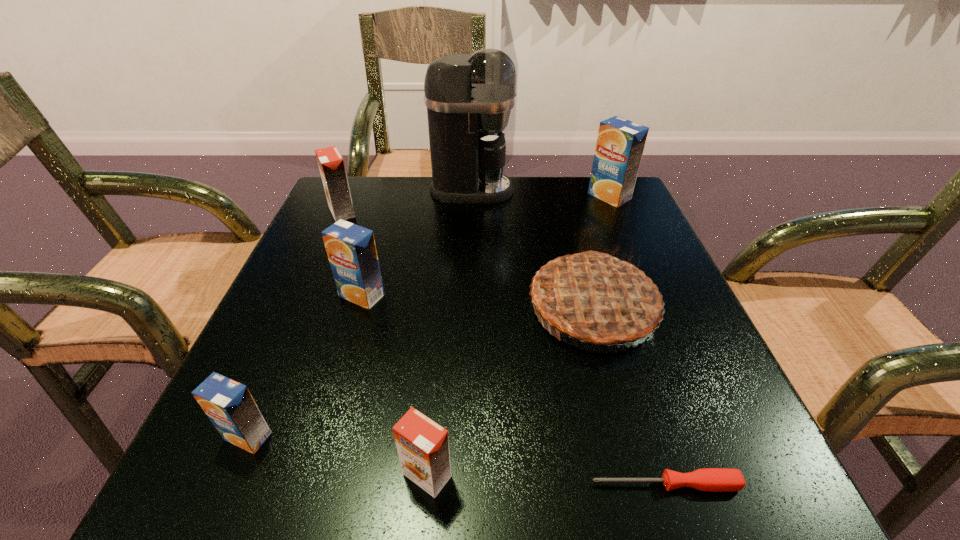
The height and width of the screenshot is (540, 960). I want to click on coffee maker, so click(463, 93).

You are a GUI agent. You are given a task and a screenshot of the screen. Output one action in this format:
    pyautogui.click(x=<x>, y=<y>)
    Task: Click on the rightmost orange juice
    The image size is (960, 540).
    Given the screenshot: What is the action you would take?
    pyautogui.click(x=620, y=144)

Find the location of `the rightmost blue orange_juice`. the rightmost blue orange_juice is located at coordinates (620, 144).

You are a GUI agent. You are given a task and a screenshot of the screen. Output one action in this format:
    pyautogui.click(x=<x>, y=<y>)
    Task: Click on the pie
    
    Given the screenshot: What is the action you would take?
    pyautogui.click(x=594, y=297)

What are the coordinates of `the farther orange orange juice` in the screenshot? It's located at (331, 164).

Locate an element on the screen. Image resolution: width=960 pixels, height=540 pixels. the bigger orange orange juice is located at coordinates (331, 164).

The height and width of the screenshot is (540, 960). I want to click on the third farthest orange juice, so (351, 249).

You are a GUI agent. You are given a task and a screenshot of the screen. Output one action in this format:
    pyautogui.click(x=<x>, y=<y>)
    Task: Click on the sixth object from right to left
    
    Given the screenshot: What is the action you would take?
    pyautogui.click(x=351, y=249)

You are a GUI agent. You are given a task and a screenshot of the screen. Output one action in this format:
    pyautogui.click(x=<x>, y=<y>)
    Task: Click on the leftmost blue orange_juice
    
    Given the screenshot: What is the action you would take?
    pyautogui.click(x=229, y=405)

Locate an element on the screen. This screenshot has height=540, width=960. the smallest blue orange_juice is located at coordinates (229, 405).